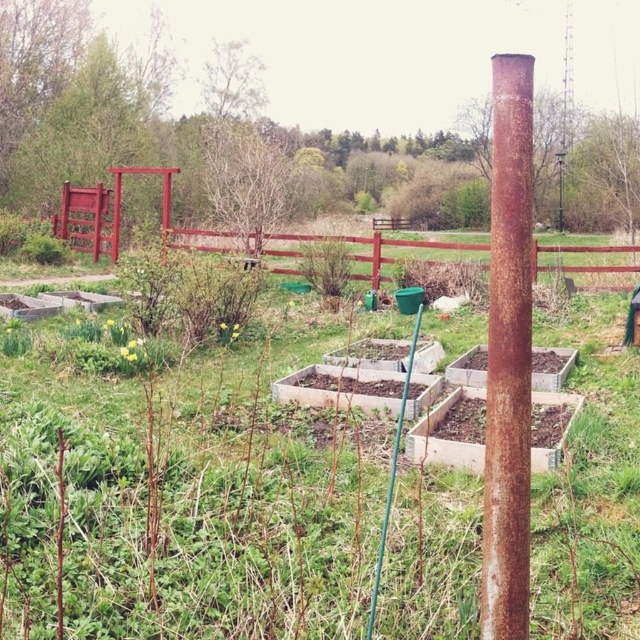
You are a gardener planning to place a new 1.5 meter wide decorative stone sculpture between the rusty metal pole at center and the rustic wooden fence at center. Based on the scene, will the sculpture fit in the space between them?

The rusty metal pole at center is narrower than the rustic wooden fence at center, but the exact distance between them isn not specified. However, since the sculpture is 1.5 meters wide, you should measure the space to ensure it can accommodate the sculpture before placing it.

You are planning to place a new decorative statue in the garden. The statue is 1.2 meters tall. Considering the sizes of the rusty metal pole at center and the rustic wooden fence at center, which object would you place the statue next to so it doesn

The rusty metal pole at center has a smaller size compared to rustic wooden fence at center. Therefore, placing the statue next to the rustic wooden fence at center would be better as the statue